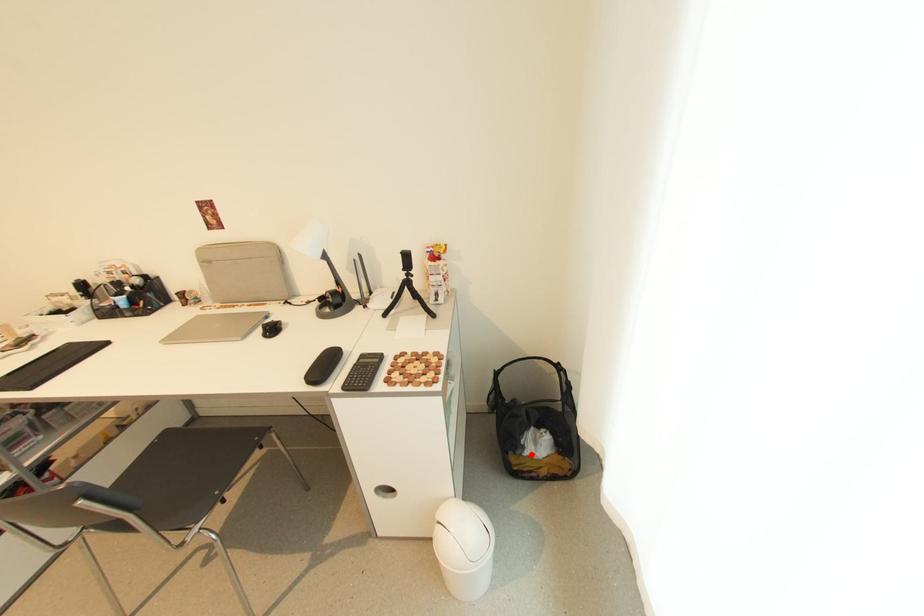
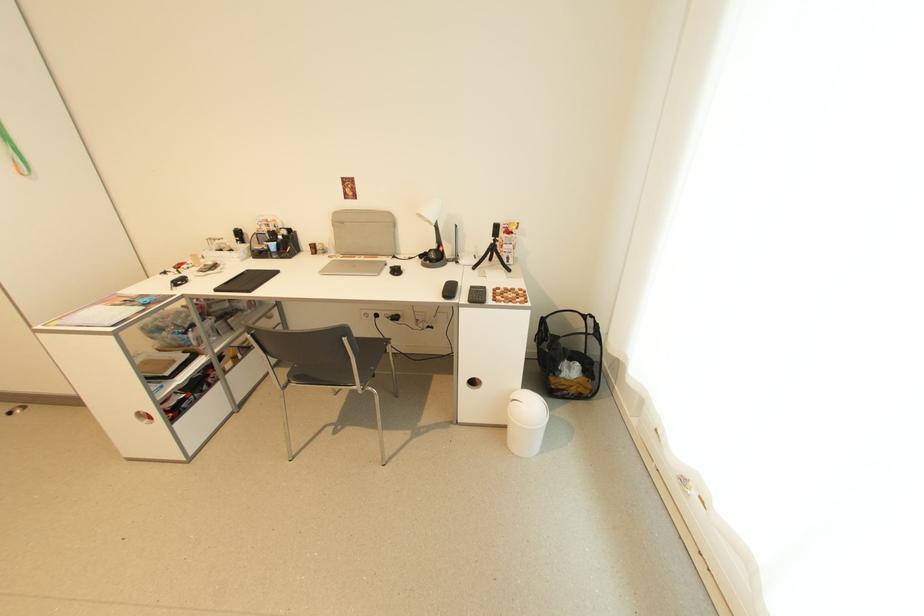
Question: I am providing you with two images of the same scene from different viewpoints. Given a red point in image1, look at the same physical point in image2. Is it:

Choices:
 (A) Closer to the viewpoint
 (B) Farther from the viewpoint

Answer: (A)